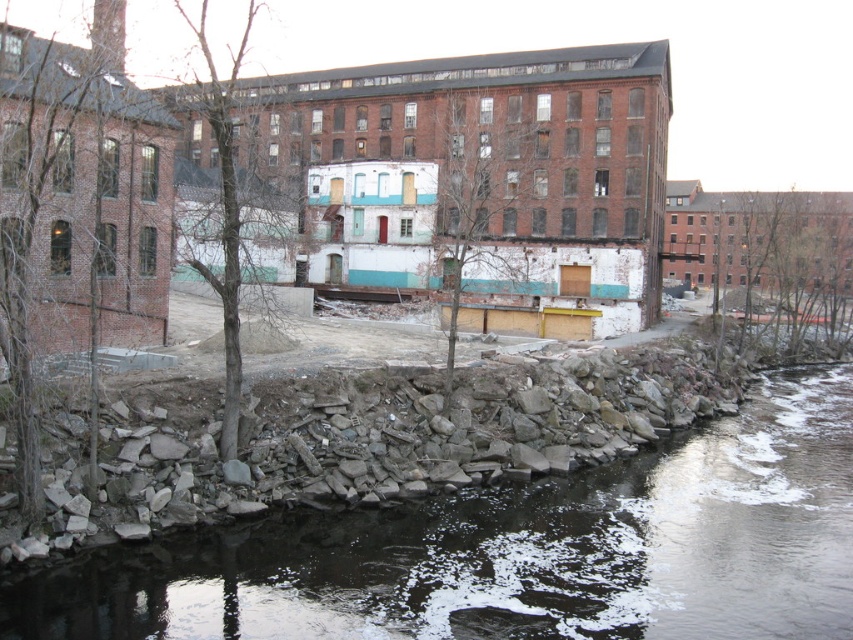
Question: Among these objects, which one is farthest from the camera?

Choices:
 (A) rocky concrete stream at lower left
 (B) brick building at center

Answer: (B)

Question: Is rocky concrete stream at lower left closer to camera compared to brick building at center?

Choices:
 (A) no
 (B) yes

Answer: (B)

Question: Can you confirm if rocky concrete stream at lower left is positioned below brick building at center?

Choices:
 (A) yes
 (B) no

Answer: (A)

Question: Does rocky concrete stream at lower left appear over brick building at center?

Choices:
 (A) yes
 (B) no

Answer: (B)

Question: Which point is farther to the camera?

Choices:
 (A) rocky concrete stream at lower left
 (B) brick building at center

Answer: (B)